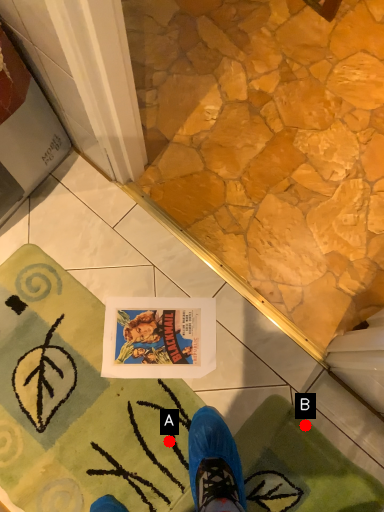
Question: Two points are circled on the image, labeled by A and B beside each circle. Which point appears closest to the camera in this image?

Choices:
 (A) A is closer
 (B) B is closer

Answer: (A)